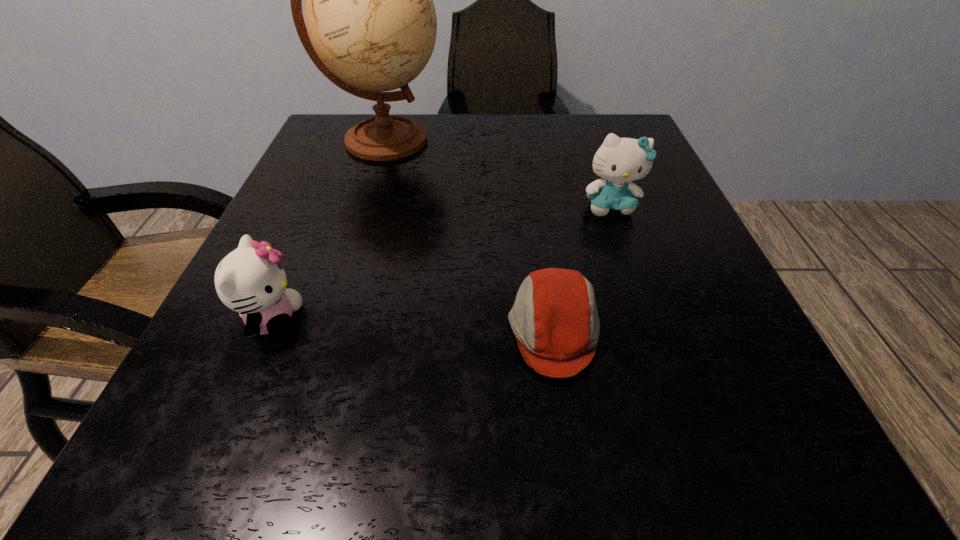
You are a GUI agent. You are given a task and a screenshot of the screen. Output one action in this format:
    pyautogui.click(x=<x>, y=<y>)
    Task: Click on the vacant region between the nearer kitten and the rightmost object
    The width and height of the screenshot is (960, 540).
    Given the screenshot: What is the action you would take?
    pyautogui.click(x=442, y=263)

Where is `unoccupied area between the tallest object and the nearer kitten`? This screenshot has height=540, width=960. unoccupied area between the tallest object and the nearer kitten is located at coordinates (328, 230).

Where is `empty location between the rightmost object and the farthest object`? The image size is (960, 540). empty location between the rightmost object and the farthest object is located at coordinates (497, 173).

Image resolution: width=960 pixels, height=540 pixels. I want to click on free space between the farthest object and the shortest object, so click(469, 235).

You are a GUI agent. You are given a task and a screenshot of the screen. Output one action in this format:
    pyautogui.click(x=<x>, y=<y>)
    Task: Click on the second closest object to the rightmost object
    This screenshot has height=540, width=960.
    Given the screenshot: What is the action you would take?
    pyautogui.click(x=371, y=25)

Identify the location of the third closest object to the second farthest object. The image size is (960, 540). (250, 280).

Locate an element on the screen. This screenshot has height=540, width=960. free region that satisfies the following two spatial constraints: 1. on the face of the third nearest object; 2. on the front-facing side of the nearer kitten is located at coordinates (651, 320).

The height and width of the screenshot is (540, 960). Identify the location of free spot that satisfies the following two spatial constraints: 1. on the face of the right kitten; 2. on the front-facing side of the shortest object. (655, 330).

Image resolution: width=960 pixels, height=540 pixels. I want to click on vacant space that satisfies the following two spatial constraints: 1. on the face of the rightmost object; 2. on the front-facing side of the shortest object, so click(655, 330).

Where is `vacant region that satisfies the following two spatial constraints: 1. on the face of the farther kitten; 2. on the front-facing side of the cap`? vacant region that satisfies the following two spatial constraints: 1. on the face of the farther kitten; 2. on the front-facing side of the cap is located at coordinates (655, 330).